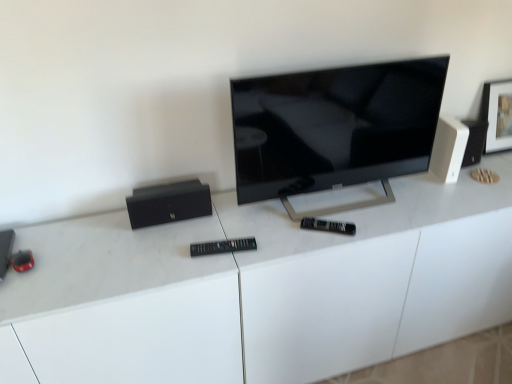
Where is `vacant space that is in between metallic black speaker at left, the 1th speaker when ordered from left to right, and white plastic speaker at upper right, arranged as the 3th speaker when viewed from the left`? Image resolution: width=512 pixels, height=384 pixels. vacant space that is in between metallic black speaker at left, the 1th speaker when ordered from left to right, and white plastic speaker at upper right, arranged as the 3th speaker when viewed from the left is located at coordinates (221, 225).